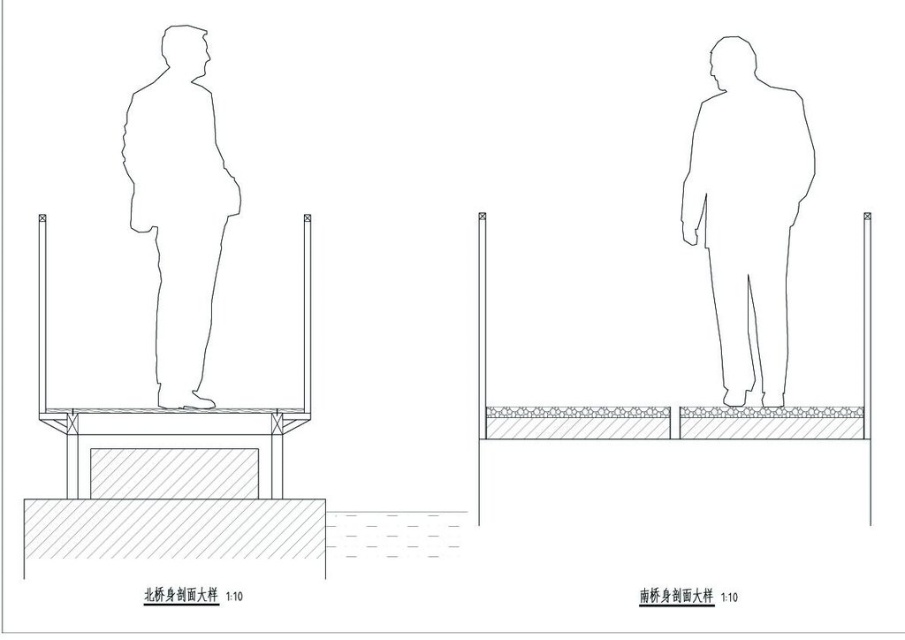
You are an engineer reviewing the technical drawing of the bridge. You notice a point labeled with coordinates at point (746,211). According to the drawing, where exactly is this point located?

The point (746,211) is on the white matte figure at center.

You are an engineer reviewing the architectural drawings of the bridge. You notice two figures depicted on the bridge deck in both the North and South cross sections. The figures are labeled as white matte figure at center and white paper man at center. According to the drawings, which figure is positioned to the right of the other?

The white matte figure at center is positioned to the right of the white paper man at center.